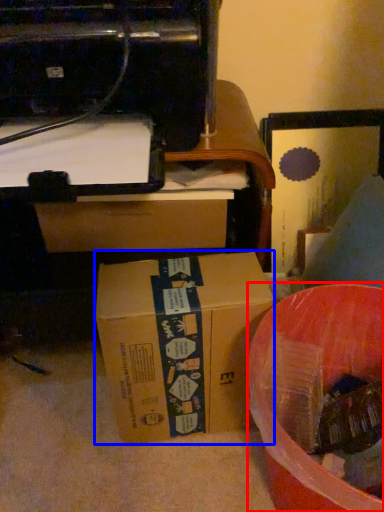
Question: Which object appears closest to the camera in this image, waste (highlighted by a red box) or box (highlighted by a blue box)?

Choices:
 (A) waste
 (B) box

Answer: (A)